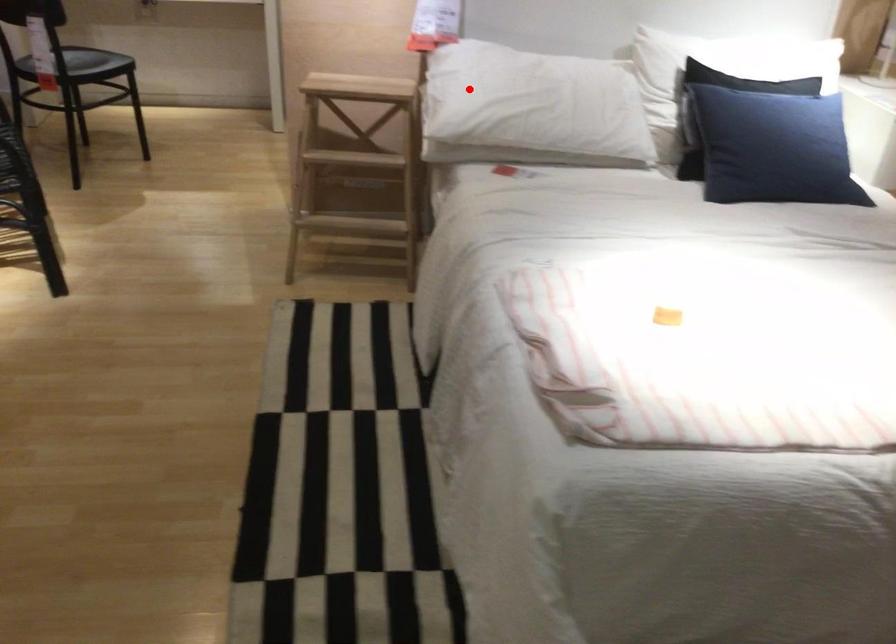
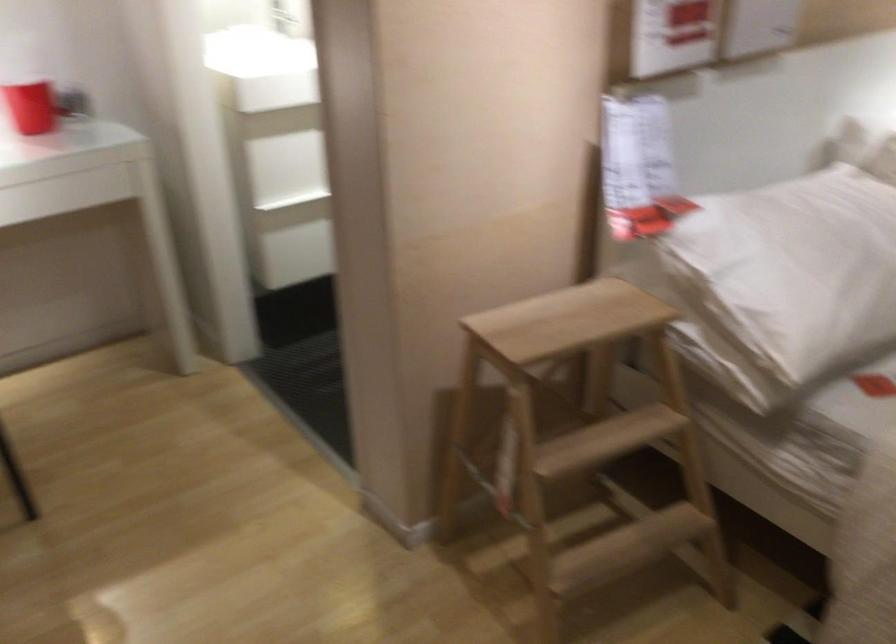
Question: I am providing you with two images of the same scene from different viewpoints. In image1, a red point is highlighted. Considering the same 3D point in image2, which of the following is correct?

Choices:
 (A) It is closer
 (B) It is farther

Answer: (A)